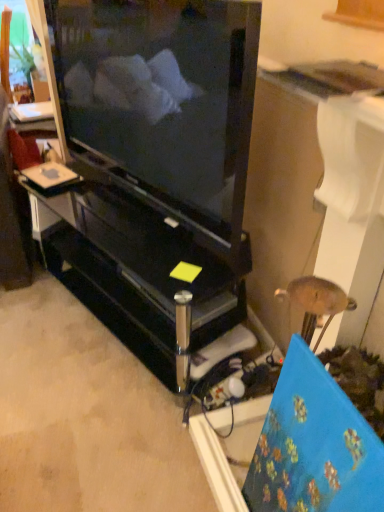
I want to click on vacant space in front of black glossy entertainment center at center, so click(x=88, y=410).